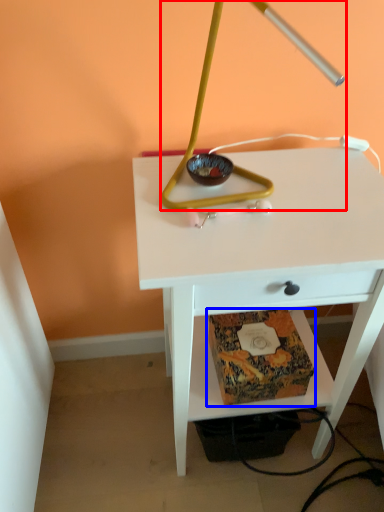
Question: Which object appears farthest to the camera in this image, lamp (highlighted by a red box) or paperback book (highlighted by a blue box)?

Choices:
 (A) lamp
 (B) paperback book

Answer: (B)